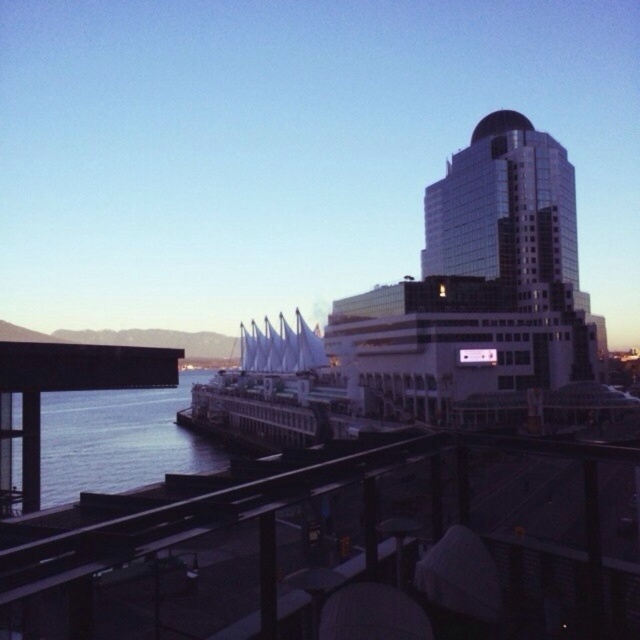
You are standing at the camera position and want to take a photo of the glossy glass building at upper right. If your camera has a maximum zoom range of 100 meters, will you be able to capture the entire building in the photo?

The glossy glass building at upper right and camera are 112.86 meters apart. Since the distance exceeds the camera maximum zoom range of 100 meters, you cannot capture the entire building in the photo.

You are a tourist standing at the waterfront and want to take a photo of the glossy glass building at upper right without the metallic rail at lower center appearing in the frame. Is it possible to position yourself in such a way that the rail is completely out of the shot?

Yes, since the glossy glass building at upper right is located above the metallic rail at lower center, you can position yourself lower or angle your camera upwards to exclude the rail from the frame.